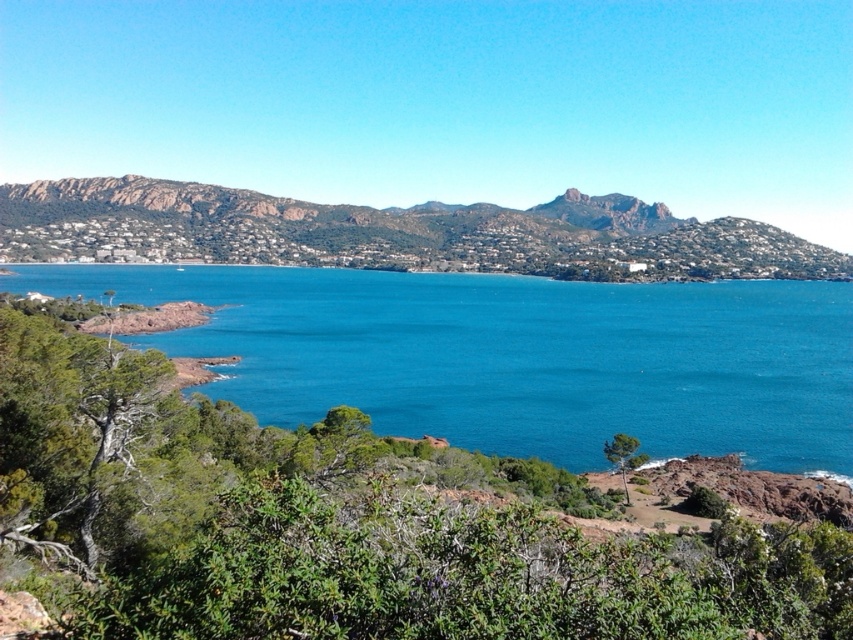
From the picture: Between blue water at center and rustic stone hillside at upper left, which one is positioned lower?

blue water at center is lower down.

Is blue water at center smaller than rustic stone hillside at upper left?

Correct, blue water at center occupies less space than rustic stone hillside at upper left.

Image resolution: width=853 pixels, height=640 pixels. In order to click on blue water at center in this screenshot , I will do `click(517, 356)`.